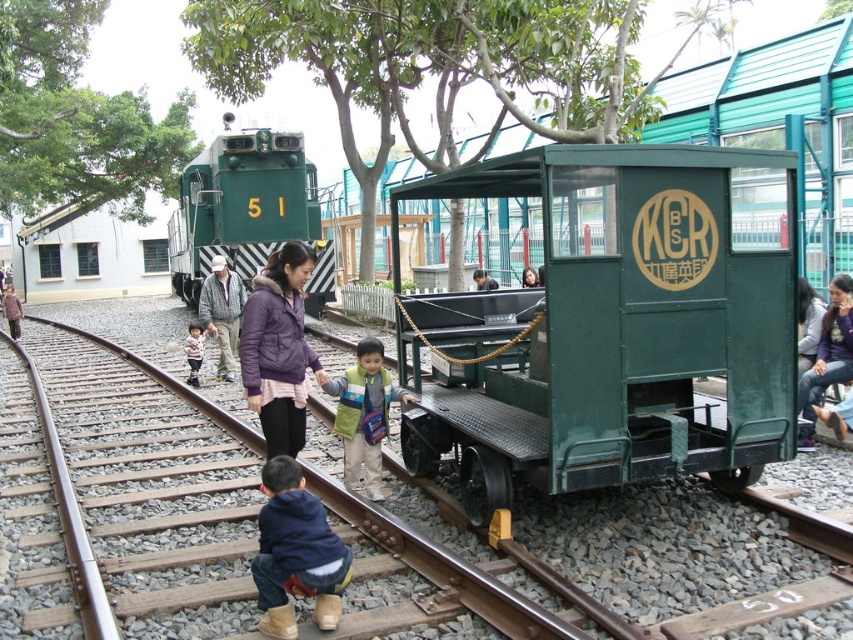
You are a photographer trying to capture a photo of the blue fleece jacket at lower center and the khaki fabric hat at center. Which object should you zoom in more on to ensure both are clearly visible in the frame?

You should zoom in more on the blue fleece jacket at lower center because it has a smaller size compared to the khaki fabric hat at center, so enlarging it will help both fit clearly in the frame.

What is the 2D coordinate of the green matte train car at center?

The green matte train car at center is located at the 2D coordinate point of [628,324].

You are a photographer standing at the edge of the railway attraction. You want to take a photo of the green matte train car at center and the purple puffy jacket at center. Based on their positions, which object is positioned to the right side of the other?

The green matte train car at center is to the right of the purple puffy jacket at center.